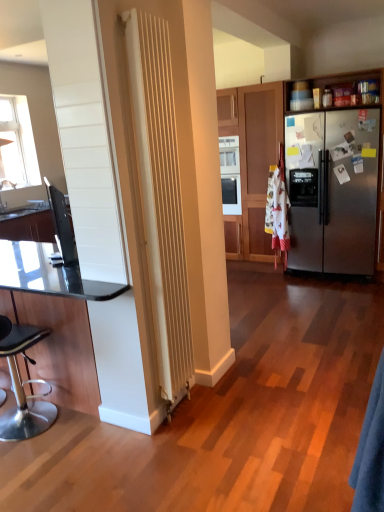
Image resolution: width=384 pixels, height=512 pixels. What do you see at coordinates (23, 387) in the screenshot?
I see `black leather stool at lower left` at bounding box center [23, 387].

This screenshot has height=512, width=384. Find the location of `transparent glass table at left`. transparent glass table at left is located at coordinates (52, 301).

I want to click on blue fabric robe at lower right, so click(x=371, y=451).

Locate an element on the screen. The image size is (384, 512). black glossy tv at left is located at coordinates (61, 226).

This screenshot has width=384, height=512. Describe the element at coordinates (61, 226) in the screenshot. I see `black glossy tv at left` at that location.

The width and height of the screenshot is (384, 512). Identify the location of black leather stool at lower left. (23, 387).

Considering the relative sizes of black leather stool at lower left and transparent glass table at left in the image provided, is black leather stool at lower left bigger than transparent glass table at left?

No.

Is black leather stool at lower left wider or thinner than transparent glass table at left?

black leather stool at lower left is thinner than transparent glass table at left.

Is black leather stool at lower left facing towards transparent glass table at left?

Yes.

Considering the positions of objects black leather stool at lower left and transparent glass table at left in the image provided, who is in front, black leather stool at lower left or transparent glass table at left?

black leather stool at lower left is more forward.

Is blue fabric robe at lower right beside black glossy tv at left?

blue fabric robe at lower right is not next to black glossy tv at left, and they're not touching.

Between blue fabric robe at lower right and black glossy tv at left, which one has less height?

black glossy tv at left is shorter.

Is blue fabric robe at lower right facing away from black glossy tv at left?

Yes, blue fabric robe at lower right's orientation is away from black glossy tv at left.

Considering the positions of point (382, 360) and point (360, 145), is point (382, 360) closer or farther from the camera than point (360, 145)?

Clearly, point (382, 360) is closer to the camera than point (360, 145).

From the image's perspective, would you say blue fabric robe at lower right is positioned over stainless steel refrigerator at right?

No, from the image's perspective, blue fabric robe at lower right is not on top of stainless steel refrigerator at right.

Measure the distance from blue fabric robe at lower right to stainless steel refrigerator at right.

blue fabric robe at lower right is 3.19 meters from stainless steel refrigerator at right.

How many degrees apart are the facing directions of black laminate countertop at left and stainless steel refrigerator at right?

89.6 degrees separate the facing orientations of black laminate countertop at left and stainless steel refrigerator at right.

Is black laminate countertop at left not within stainless steel refrigerator at right?

Yes, black laminate countertop at left is not within stainless steel refrigerator at right.

Considering the relative positions of black laminate countertop at left and stainless steel refrigerator at right in the image provided, is black laminate countertop at left to the right of stainless steel refrigerator at right from the viewer's perspective?

Result: Incorrect, black laminate countertop at left is not on the right side of stainless steel refrigerator at right.

Between point (31, 209) and point (250, 253), which one is positioned in front?

Positioned in front is point (31, 209).

Is black leather stool at lower left located outside blue fabric robe at lower right?

black leather stool at lower left lies outside blue fabric robe at lower right's area.

Is the position of black leather stool at lower left more distant than that of blue fabric robe at lower right?

Yes, it is.

Which object is positioned more to the left, black leather stool at lower left or blue fabric robe at lower right?

black leather stool at lower left.

Considering the positions of objects black glossy tv at left and black laminate countertop at left in the image provided, who is in front, black glossy tv at left or black laminate countertop at left?

black glossy tv at left is closer to the camera.

In terms of size, does black glossy tv at left appear bigger or smaller than black laminate countertop at left?

Considering their sizes, black glossy tv at left takes up more space than black laminate countertop at left.

From the image's perspective, is black glossy tv at left beneath black laminate countertop at left?

Yes, from the image's perspective, black glossy tv at left is beneath black laminate countertop at left.

Looking at this image, is black laminate countertop at left inside black glossy tv at left?

Actually, black laminate countertop at left is outside black glossy tv at left.

Considering the positions of point (106, 300) and point (69, 225), is point (106, 300) closer or farther from the camera than point (69, 225)?

Clearly, point (106, 300) is closer to the camera than point (69, 225).

Is black glossy tv at left at the back of transparent glass table at left?

No, black glossy tv at left is not at the back of transparent glass table at left.

Find the location of `table below the black glossy tv at left (from a real-world perspective)`. table below the black glossy tv at left (from a real-world perspective) is located at coordinates (52, 301).

Considering the sizes of transparent glass table at left and black glossy tv at left in the image, is transparent glass table at left taller or shorter than black glossy tv at left?

transparent glass table at left is taller than black glossy tv at left.

Identify the location of chair located below the transparent glass table at left (from the image's perspective). This screenshot has width=384, height=512. (23, 387).

This screenshot has width=384, height=512. What are the coordinates of `robe on the right of black glossy tv at left` in the screenshot? It's located at (371, 451).

Considering their positions, is black laminate countertop at left positioned closer to black glossy tv at left than transparent glass table at left?

transparent glass table at left.

When comparing their distances from stainless steel refrigerator at right, does blue fabric robe at lower right or black glossy tv at left seem closer?

The object closer to stainless steel refrigerator at right is black glossy tv at left.

Estimate the real-world distances between objects in this image. Which object is closer to transparent glass table at left, stainless steel refrigerator at right or black laminate countertop at left?

black laminate countertop at left.

From the image, which object appears to be farther from blue fabric robe at lower right, black leather stool at lower left or black laminate countertop at left?

black laminate countertop at left lies further to blue fabric robe at lower right than the other object.

Based on their spatial positions, is blue fabric robe at lower right or transparent glass table at left closer to black laminate countertop at left?

transparent glass table at left.

Consider the image. Considering their positions, is stainless steel refrigerator at right positioned further to black glossy tv at left than blue fabric robe at lower right?

stainless steel refrigerator at right is further to black glossy tv at left.

When comparing their distances from black leather stool at lower left, does transparent glass table at left or blue fabric robe at lower right seem further?

blue fabric robe at lower right lies further to black leather stool at lower left than the other object.

When comparing their distances from stainless steel refrigerator at right, does black glossy tv at left or blue fabric robe at lower right seem further?

Among the two, blue fabric robe at lower right is located further to stainless steel refrigerator at right.

Locate an element on the screen. The height and width of the screenshot is (512, 384). chair located between transparent glass table at left and blue fabric robe at lower right in the left-right direction is located at coordinates (23, 387).

Image resolution: width=384 pixels, height=512 pixels. In order to click on appliance located between black leather stool at lower left and blue fabric robe at lower right in the left-right direction in this screenshot , I will do `click(61, 226)`.

Find the location of a particular element. The width and height of the screenshot is (384, 512). appliance between blue fabric robe at lower right and stainless steel refrigerator at right along the z-axis is located at coordinates click(61, 226).

You are a GUI agent. You are given a task and a screenshot of the screen. Output one action in this format:
    pyautogui.click(x=<x>, y=<y>)
    Task: Click on the table between black leather stool at lower left and black laminate countertop at left from front to back
    This screenshot has height=512, width=384.
    Given the screenshot: What is the action you would take?
    pyautogui.click(x=52, y=301)